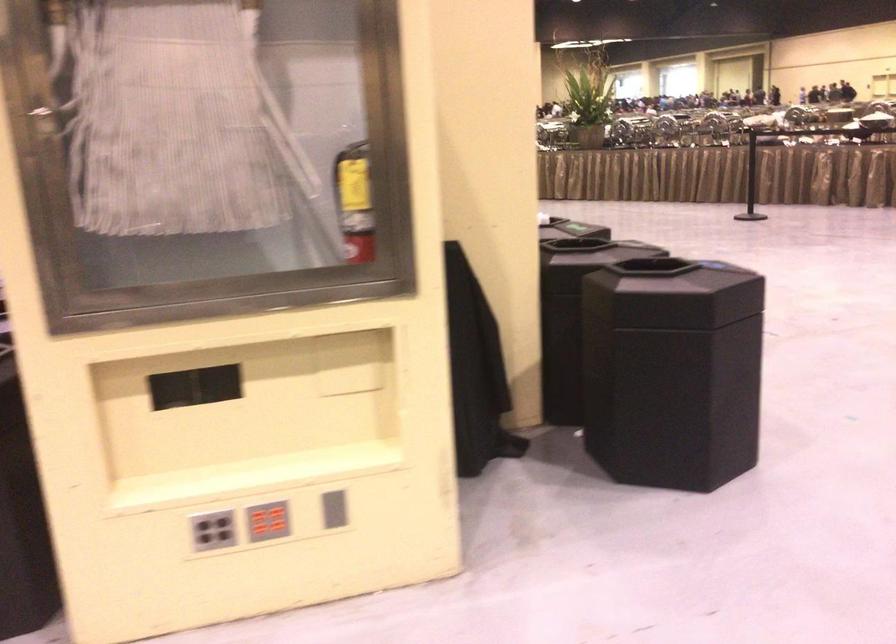
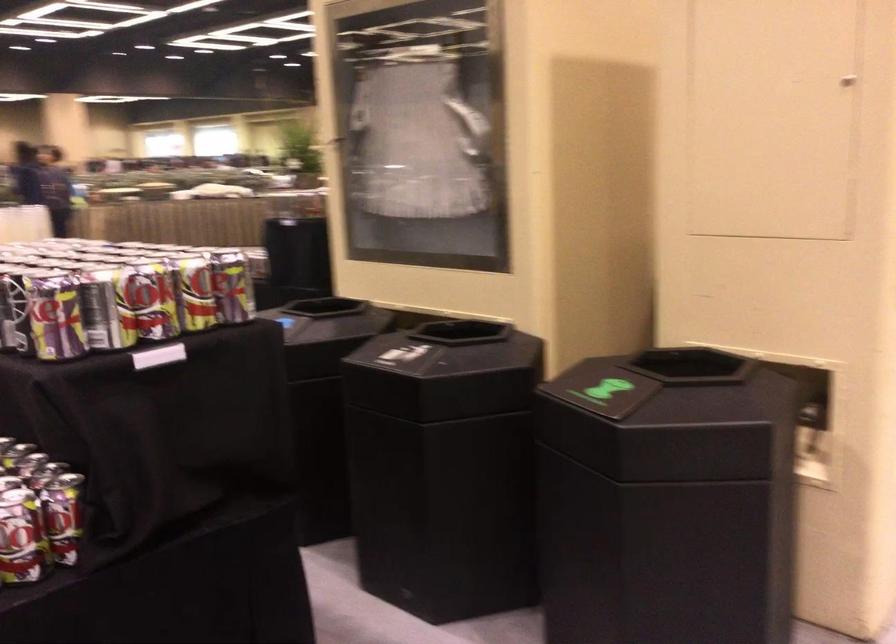
Question: I am providing you with two images of the same scene from different viewpoints. Please identify which objects are invisible in image2.

Choices:
 (A) black bin opening
 (B) yellow textbook
 (C) beverage can
 (D) grey vertical slot

Answer: (D)